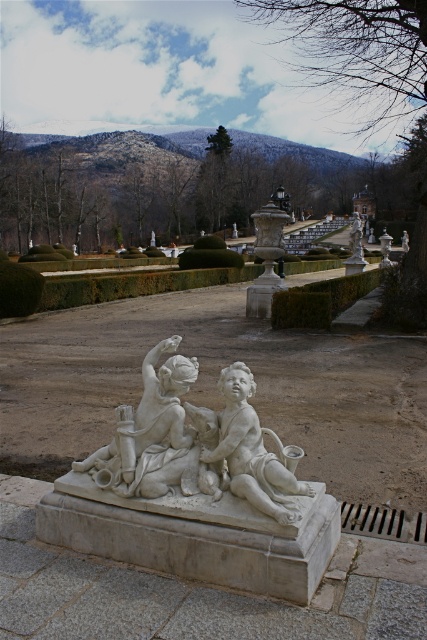
Question: Estimate the real-world distances between objects in this image. Which object is closer to the white marble statue at upper right?

Choices:
 (A) white marble sculpture at center
 (B) white marble cherub at center

Answer: (B)

Question: Which object appears farthest from the camera in this image?

Choices:
 (A) white marble cherub at center
 (B) white marble statue at upper right
 (C) white marble sculpture at center

Answer: (B)

Question: Is white marble sculpture at center wider than white marble statue at upper right?

Choices:
 (A) no
 (B) yes

Answer: (A)

Question: Does white marble sculpture at center have a lesser width compared to white marble statue at upper right?

Choices:
 (A) yes
 (B) no

Answer: (A)

Question: Which object is closer to the camera taking this photo?

Choices:
 (A) white marble cherub at center
 (B) white marble statue at upper right

Answer: (A)

Question: Does white marble sculpture at center appear over white marble statue at upper right?

Choices:
 (A) yes
 (B) no

Answer: (B)